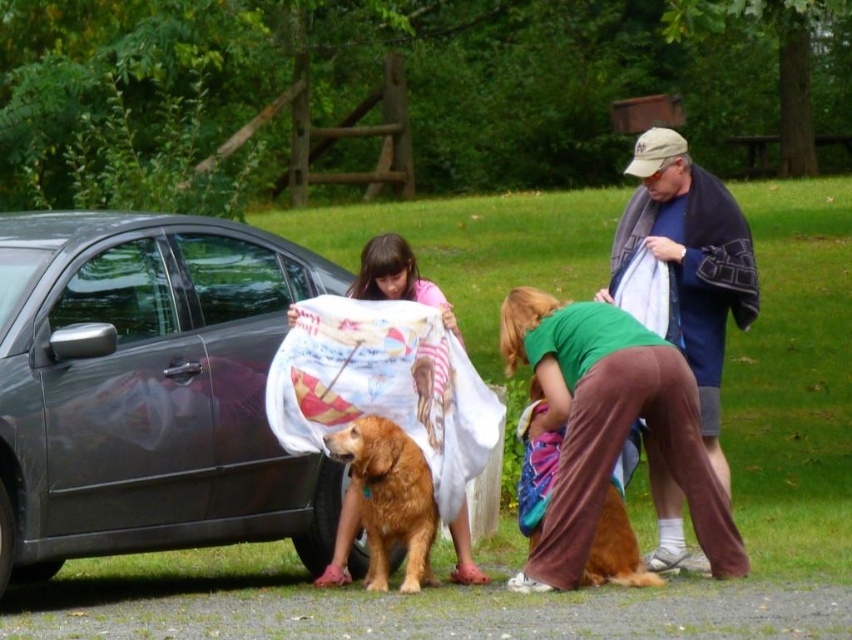
Is point (393, 540) in front of point (540, 419)?

No, it is not.

Does golden fur dog at lower center come behind brown furry dog at lower center?

Yes, it is.

What do you see at coordinates (389, 497) in the screenshot?
I see `golden fur dog at lower center` at bounding box center [389, 497].

Where is `golden fur dog at lower center`? This screenshot has height=640, width=852. golden fur dog at lower center is located at coordinates (389, 497).

Who is shorter, shiny black car at left or golden fur dog at lower center?

golden fur dog at lower center

Does shiny black car at left have a lesser width compared to golden fur dog at lower center?

No.

This screenshot has width=852, height=640. What do you see at coordinates (148, 388) in the screenshot?
I see `shiny black car at left` at bounding box center [148, 388].

Identify the location of shiny black car at left. Image resolution: width=852 pixels, height=640 pixels. point(148,388).

Is green fabric at lower center shorter than matte pink shirt at center?

No, green fabric at lower center is not shorter than matte pink shirt at center.

Is green fabric at lower center bigger than matte pink shirt at center?

Indeed, green fabric at lower center has a larger size compared to matte pink shirt at center.

What do you see at coordinates (608, 426) in the screenshot? I see `green fabric at lower center` at bounding box center [608, 426].

Image resolution: width=852 pixels, height=640 pixels. I want to click on green fabric at lower center, so click(x=608, y=426).